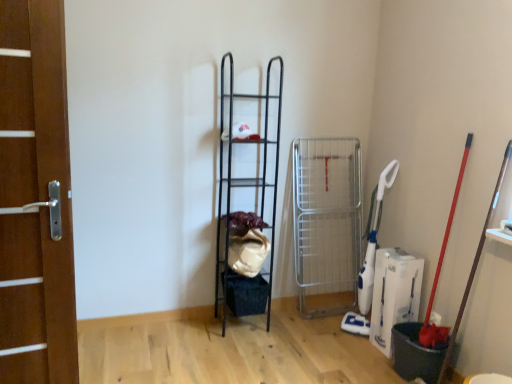
Locate an element on the screen. This screenshot has width=512, height=384. free spot to the right of black metal shelf at center is located at coordinates (288, 326).